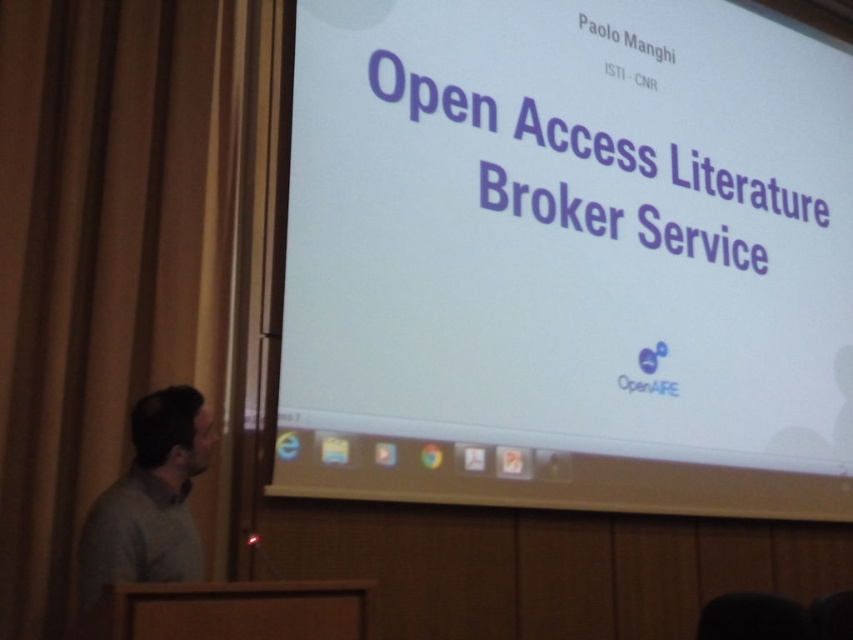
Question: Can you confirm if white matte projection screen at center is positioned to the left of gray sweater at left?

Choices:
 (A) no
 (B) yes

Answer: (A)

Question: Which point is farther from the camera taking this photo?

Choices:
 (A) (166, 413)
 (B) (447, 460)

Answer: (B)

Question: Which point is farther to the camera?

Choices:
 (A) white matte projection screen at center
 (B) gray sweater at left

Answer: (A)

Question: Can you confirm if white matte projection screen at center is thinner than gray sweater at left?

Choices:
 (A) yes
 (B) no

Answer: (B)

Question: Can you confirm if white matte projection screen at center is wider than gray sweater at left?

Choices:
 (A) yes
 (B) no

Answer: (A)